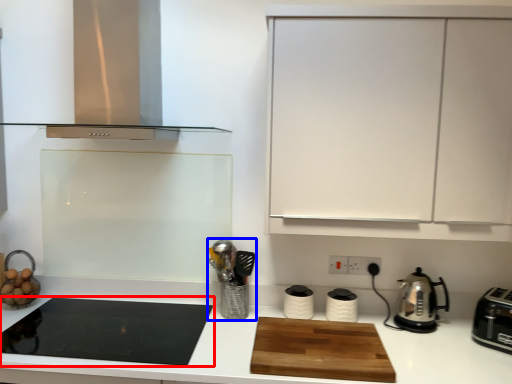
Question: Among these objects, which one is nearest to the camera, gas stove (highlighted by a red box) or appliance (highlighted by a blue box)?

Choices:
 (A) gas stove
 (B) appliance

Answer: (A)